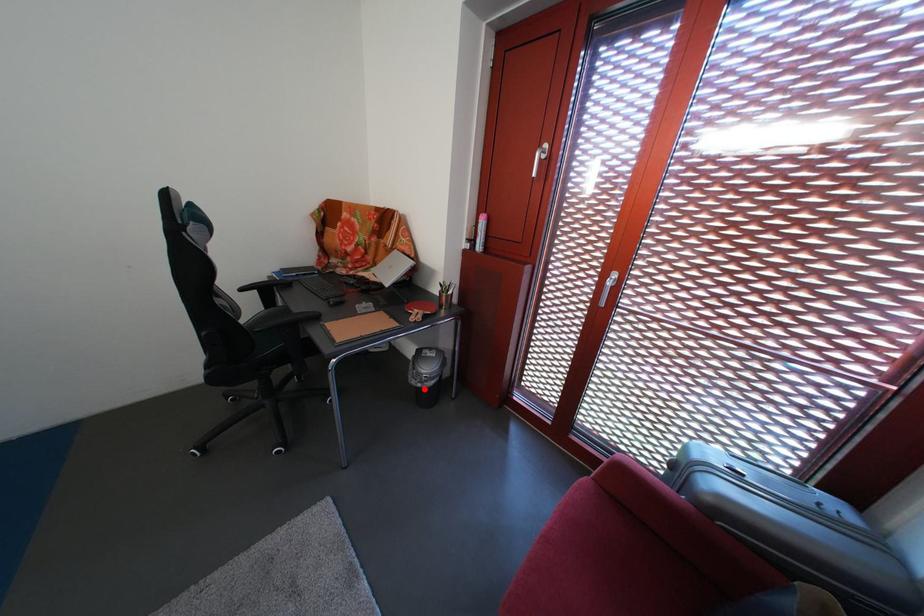
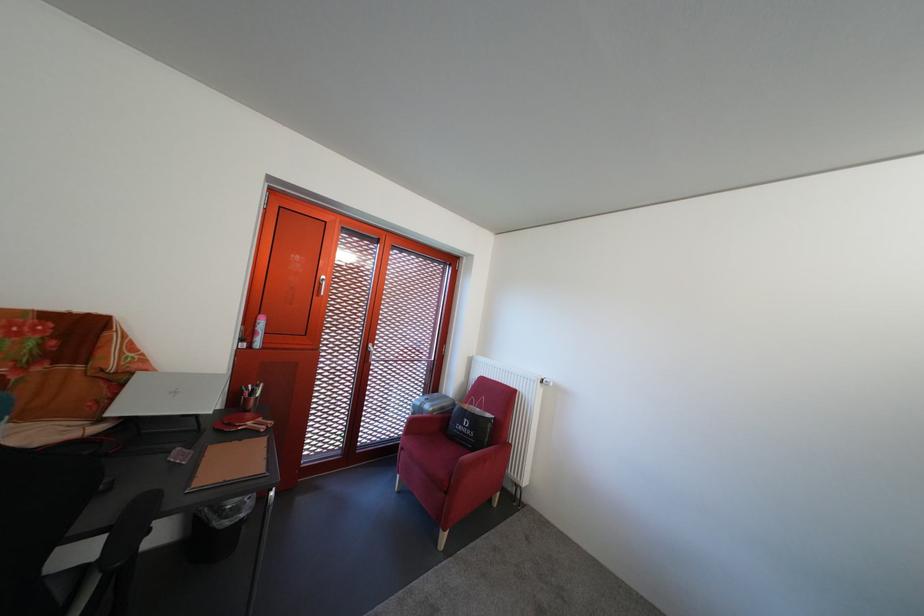
Question: I am providing you with two images of the same scene from different viewpoints. A red point is shown in image1. For the corresponding object point in image2, is it positioned nearer or farther from the camera?

Choices:
 (A) Nearer
 (B) Farther

Answer: (A)